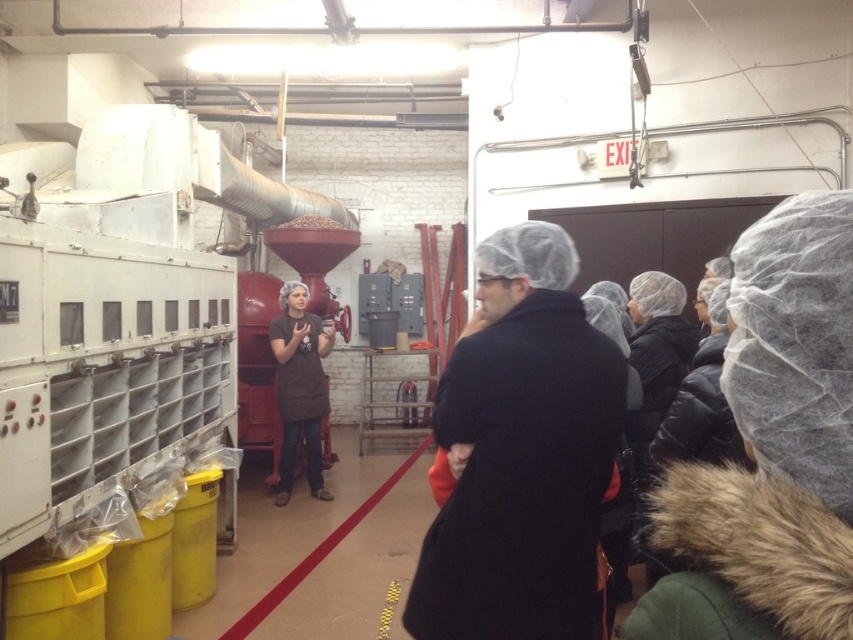
In the image of the industrial facility tour, there is a point marked at coordinate (299,387). What object is located at this coordinate?

The point at coordinate (299,387) indicates the brown fabric apron at center.

You are standing in the factory and want to move from point A to point B. Point A is at coordinate point [312,336] and point B is at coordinate point [279,586]. Which point is closer to you?

Point A at coordinate point [312,336] is closer to you because it is further to the viewer than point B at coordinate point [279,586].